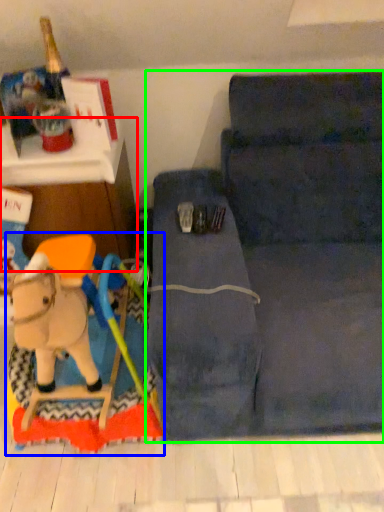
Question: Which is nearer to the furniture (highlighted by a red box)? toy (highlighted by a blue box) or studio couch (highlighted by a green box).

Choices:
 (A) toy
 (B) studio couch

Answer: (A)